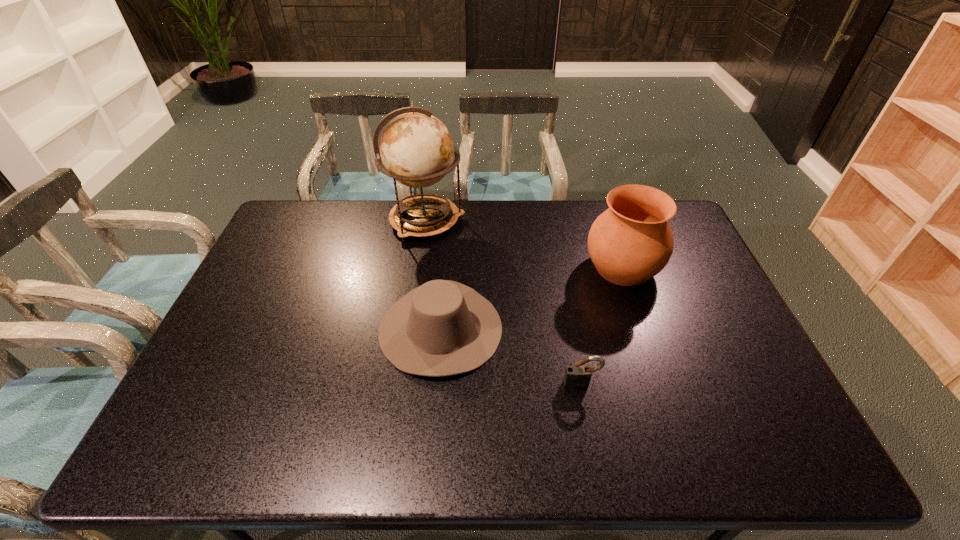
Find the location of a particular element. free space between the cowboy hat and the tallest object is located at coordinates (433, 275).

Image resolution: width=960 pixels, height=540 pixels. Identify the location of unoccupied position between the cowboy hat and the rightmost object. (532, 298).

Identify the location of empty space that is in between the cowboy hat and the pottery. Image resolution: width=960 pixels, height=540 pixels. (532, 298).

Locate an element on the screen. empty space that is in between the globe and the padlock is located at coordinates (503, 302).

The height and width of the screenshot is (540, 960). Find the location of `free spot between the cowboy hat and the third object from left to right`. free spot between the cowboy hat and the third object from left to right is located at coordinates point(511,356).

What are the coordinates of `free space between the padlock and the cowboy hat` in the screenshot? It's located at (511, 356).

You are a GUI agent. You are given a task and a screenshot of the screen. Output one action in this format:
    pyautogui.click(x=<x>, y=<y>)
    Task: Click on the free spot between the padlock and the cowboy hat
    
    Given the screenshot: What is the action you would take?
    [x=511, y=356]

Image resolution: width=960 pixels, height=540 pixels. What are the coordinates of `object identified as the second closest to the globe` in the screenshot? It's located at (629, 243).

Where is `object that is the closest to the cowboy hat`? The height and width of the screenshot is (540, 960). object that is the closest to the cowboy hat is located at coordinates [578, 376].

This screenshot has height=540, width=960. I want to click on free space that satisfies the following two spatial constraints: 1. at the center of the globe; 2. on the back side of the cowboy hat, so click(x=410, y=328).